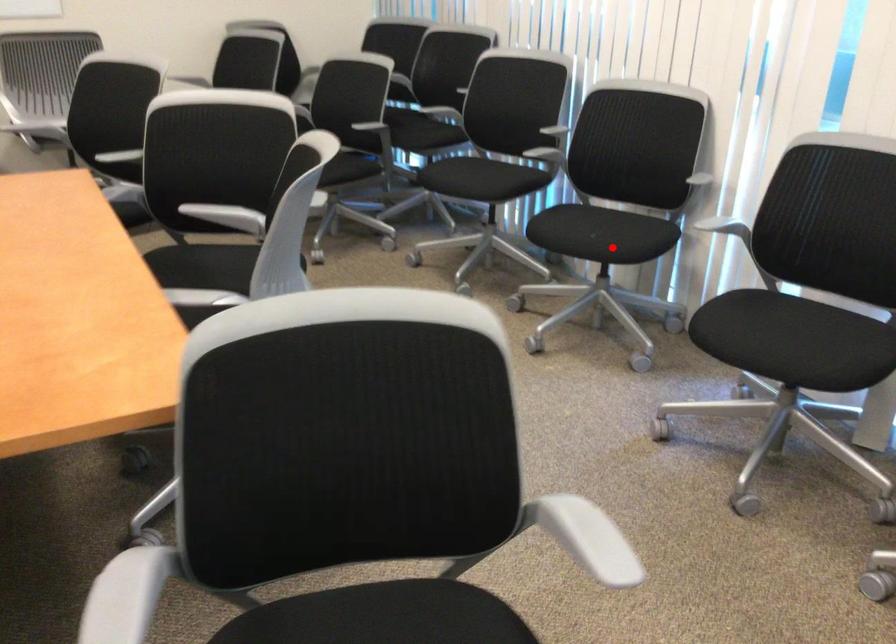
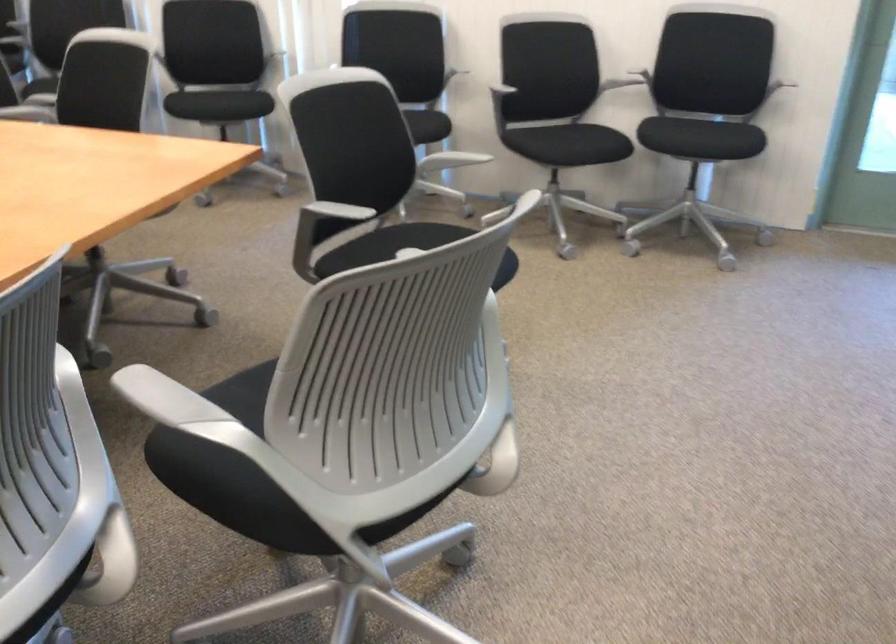
In the second image, find the point that corresponds to the highlighted location in the first image.

(238, 102)